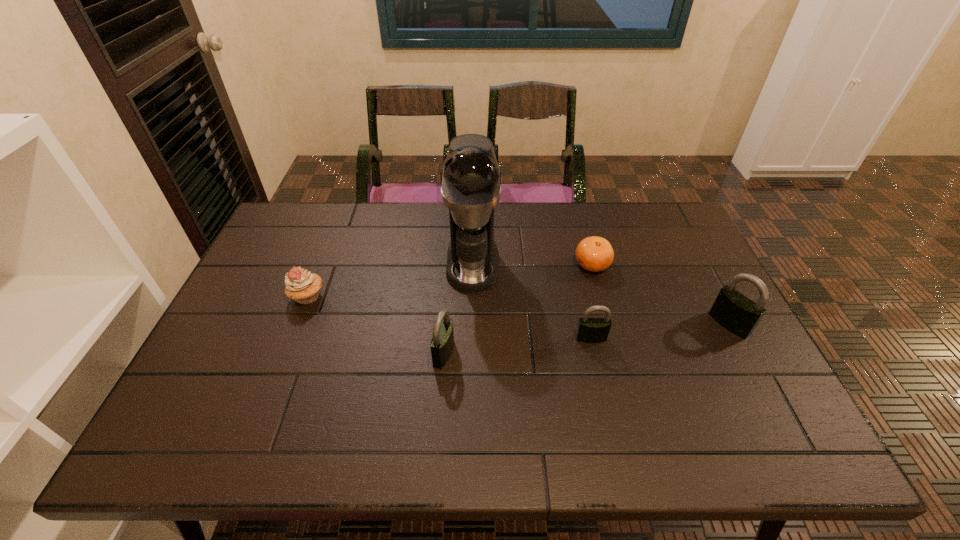
Find the location of a particular element. padlock that stands as the second closest to the fourth shortest object is located at coordinates (738, 314).

Choose which padlock is the nearest neighbor to the second shortest padlock. Please provide its 2D coordinates. Your answer should be formatted as a tuple, i.e. [(x, y)], where the tuple contains the x and y coordinates of a point satisfying the conditions above.

[(589, 330)]

Where is `free space that satisfies the following two spatial constraints: 1. on the front side of the rightmost padlock; 2. on the left side of the clementine`? The width and height of the screenshot is (960, 540). free space that satisfies the following two spatial constraints: 1. on the front side of the rightmost padlock; 2. on the left side of the clementine is located at coordinates (608, 324).

This screenshot has height=540, width=960. Find the location of `free space in the image that satisfies the following two spatial constraints: 1. place cup under the spout of the second padlock from right to left; 2. on the left side of the coffee maker`. free space in the image that satisfies the following two spatial constraints: 1. place cup under the spout of the second padlock from right to left; 2. on the left side of the coffee maker is located at coordinates (471, 338).

I want to click on free space that satisfies the following two spatial constraints: 1. place cup under the spout of the coffee maker; 2. on the left side of the rightmost padlock, so click(x=471, y=324).

Locate an element on the screen. free location that satisfies the following two spatial constraints: 1. on the front side of the rightmost padlock; 2. on the left side of the shortest object is located at coordinates (608, 324).

Where is `free space that satisfies the following two spatial constraints: 1. on the back side of the rightmost padlock; 2. on the right side of the second padlock from left to right`? The image size is (960, 540). free space that satisfies the following two spatial constraints: 1. on the back side of the rightmost padlock; 2. on the right side of the second padlock from left to right is located at coordinates (588, 324).